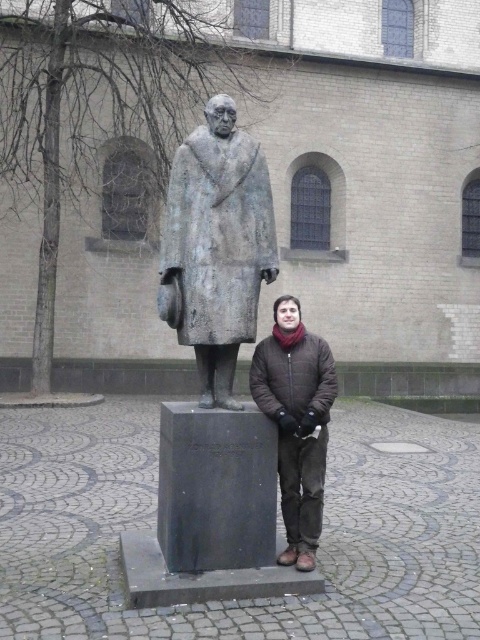
You are standing in front of a building and see the bronze statue at center and the brown quilted jacket at center. Which object is closer to you?

The bronze statue at center is closer to the viewer than the brown quilted jacket at center.

You are a photographer trying to capture a photo of the bronze statue at center. You need to position yourself exactly at point (218,244) to get the perfect shot. Can you confirm the location of the bronze statue at center?

The bronze statue at center is located at point (218,244), so yes, positioning yourself at that point will allow you to capture the perfect shot of the bronze statue at center.